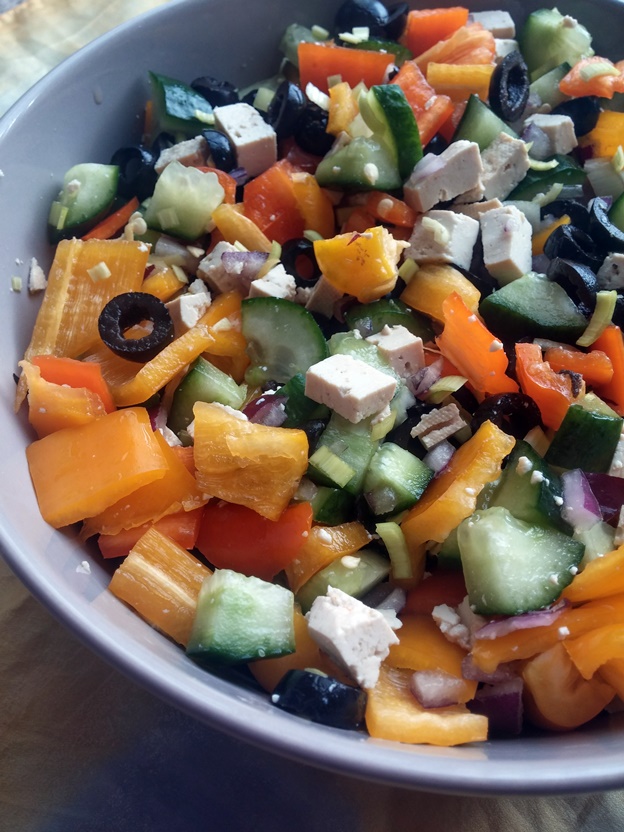
The width and height of the screenshot is (624, 832). What are the coordinates of `top left arc of white bowl` in the screenshot? It's located at (27, 115), (99, 36).